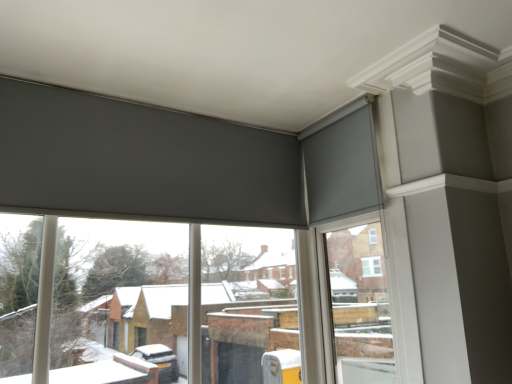
Question: Is smooth white window frame at upper right closer to camera compared to matte gray roller blinds at upper center?

Choices:
 (A) yes
 (B) no

Answer: (B)

Question: From the image's perspective, is smooth white window frame at upper right above matte gray roller blinds at upper center?

Choices:
 (A) no
 (B) yes

Answer: (B)

Question: Is smooth white window frame at upper right taller than matte gray roller blinds at upper center?

Choices:
 (A) no
 (B) yes

Answer: (B)

Question: Does smooth white window frame at upper right contain matte gray roller blinds at upper center?

Choices:
 (A) yes
 (B) no

Answer: (B)

Question: From a real-world perspective, is smooth white window frame at upper right positioned under matte gray roller blinds at upper center based on gravity?

Choices:
 (A) no
 (B) yes

Answer: (A)

Question: Can you confirm if smooth white window frame at upper right is thinner than matte gray roller blinds at upper center?

Choices:
 (A) no
 (B) yes

Answer: (B)

Question: Is smooth white window frame at upper right to the right of matte gray curtain at upper right from the viewer's perspective?

Choices:
 (A) no
 (B) yes

Answer: (B)

Question: Is smooth white window frame at upper right closer to the viewer compared to matte gray curtain at upper right?

Choices:
 (A) yes
 (B) no

Answer: (A)

Question: From a real-world perspective, is smooth white window frame at upper right on matte gray curtain at upper right?

Choices:
 (A) no
 (B) yes

Answer: (A)

Question: Does smooth white window frame at upper right turn towards matte gray curtain at upper right?

Choices:
 (A) yes
 (B) no

Answer: (A)

Question: Does smooth white window frame at upper right have a lesser height compared to matte gray curtain at upper right?

Choices:
 (A) yes
 (B) no

Answer: (B)

Question: Is the depth of smooth white window frame at upper right greater than that of matte gray curtain at upper right?

Choices:
 (A) yes
 (B) no

Answer: (B)

Question: Does matte gray curtain at upper right have a larger size compared to matte gray roller blinds at upper center?

Choices:
 (A) yes
 (B) no

Answer: (B)